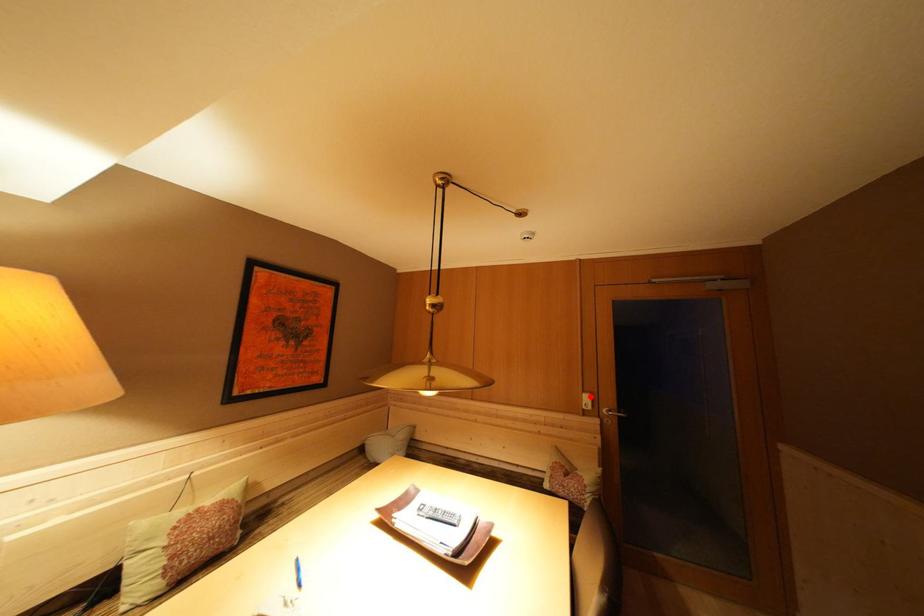
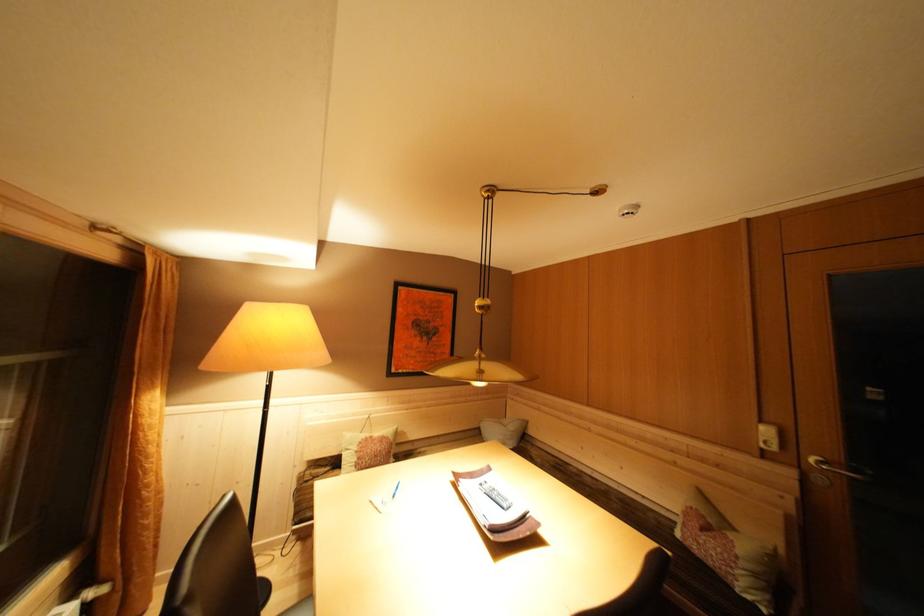
Where in the second image is the point corresponding to the highlighted location from the first image?

(768, 427)